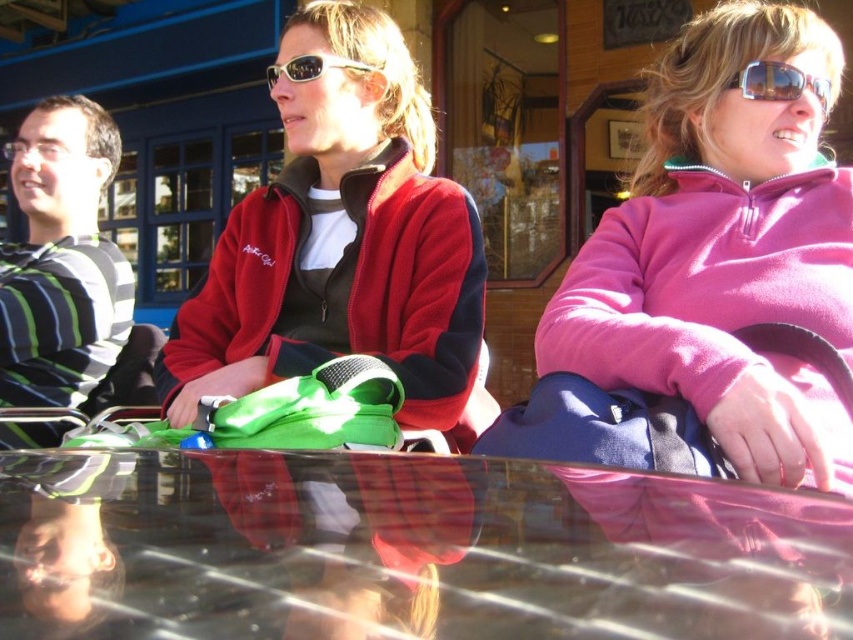
You are standing at the edge of the image and want to place a large potted plant on the transparent glass table at center. Based on the coordinates provided, can you determine if the table is positioned in the lower half of the image?

The transparent glass table at center is located at coordinates point (405, 550). Since the y coordinate 0.477 is less than 0.5, it means the table is positioned in the lower half of the image.

You are at a cafe and want to place a small coffee cup on the transparent glass table at center. However, there is already a phone placed on the striped cotton shirt at left. Which object is closer to the edge of the table where you want to put the cup?

The striped cotton shirt at left is closer to the edge of the transparent glass table at center because the table is to the right of the shirt, so placing the cup there would be near the shirt.

You are a photographer trying to capture a candid shot of the two people wearing sunglasses at upper right and sunglasses at center. Since you want to ensure both are clearly visible, which pair of sunglasses should you focus on first to avoid blurring due to size differences?

The sunglasses at upper right is smaller than sunglasses at center, so you should focus on the sunglasses at center first to ensure clarity since larger objects are easier to capture clearly without blurring.